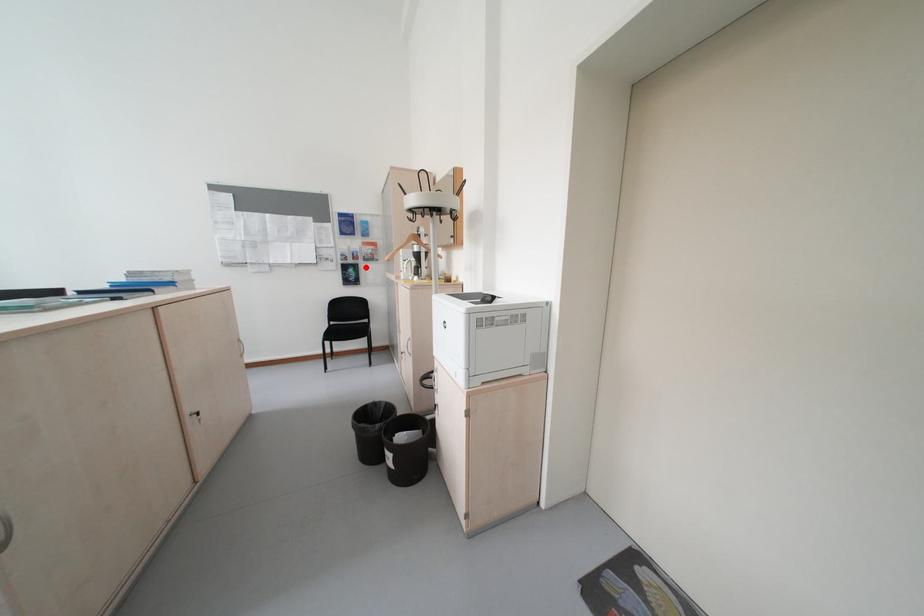
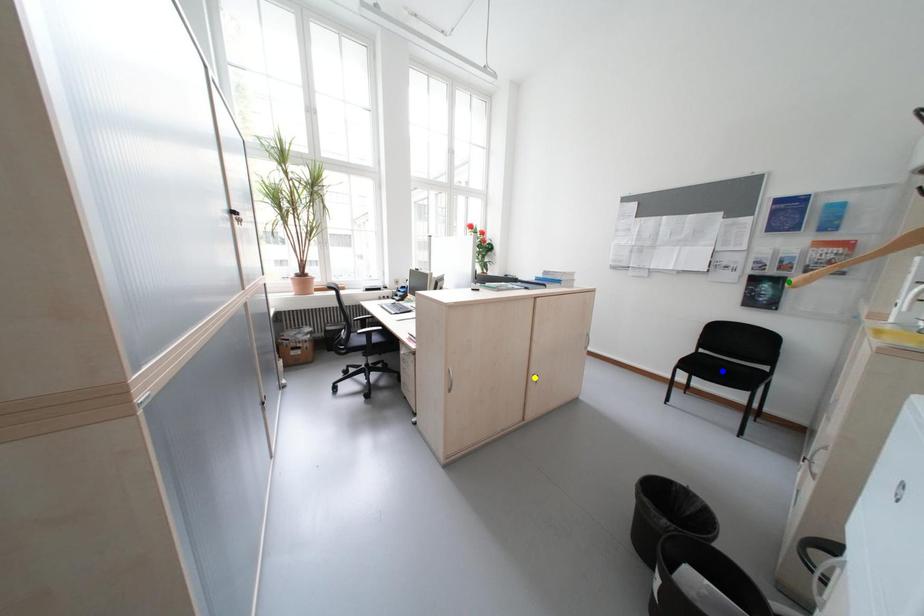
Question: I am providing you with two images of the same scene from different viewpoints. A red point is marked on the first image. You are given multiple points on the second image. In image 2, which mark is for the same physical point as the one in image 1?

Choices:
 (A) green point
 (B) yellow point
 (C) blue point

Answer: (A)